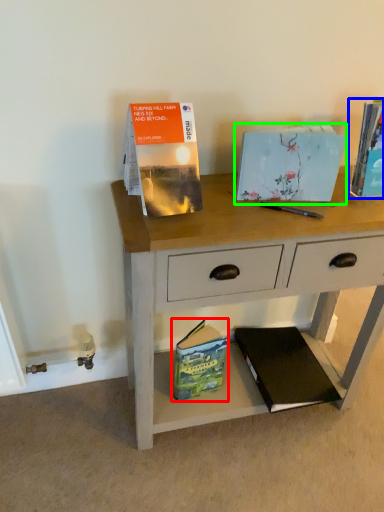
Question: Which object is the closest to the paperback book (highlighted by a red box)? Choose among these: paperback book (highlighted by a blue box) or paperback book (highlighted by a green box).

Choices:
 (A) paperback book
 (B) paperback book

Answer: (B)